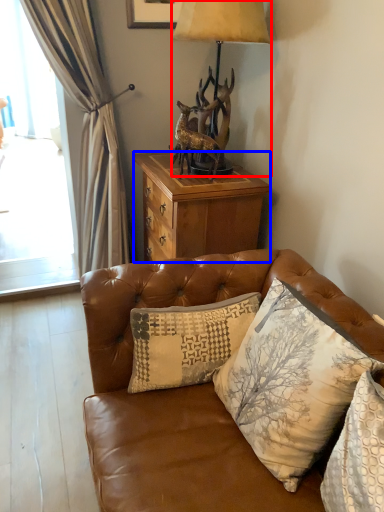
Question: Which point is closer to the camera, lamp (highlighted by a red box) or desk (highlighted by a blue box)?

Choices:
 (A) lamp
 (B) desk

Answer: (A)